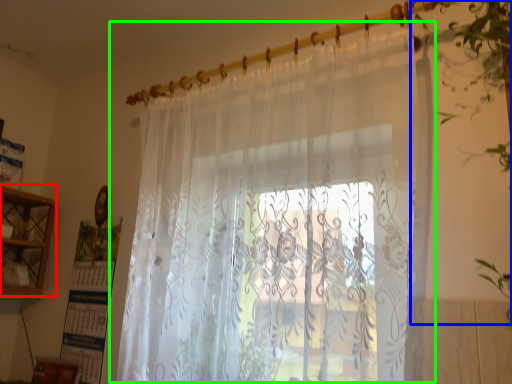
Question: Considering the real-world distances, which object is farthest from cabinet (highlighted by a red box)? vegetation (highlighted by a blue box) or curtain (highlighted by a green box)?

Choices:
 (A) vegetation
 (B) curtain

Answer: (A)